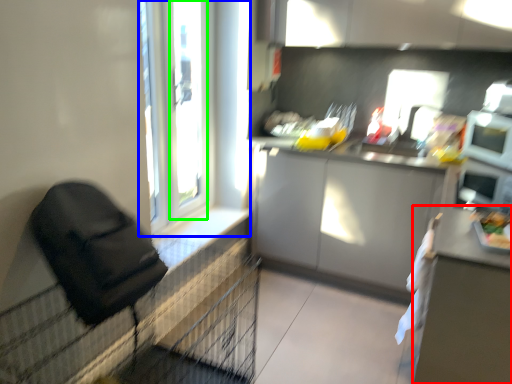
Question: Based on their relative distances, which object is nearer to table (highlighted by a red box)? Choose from window (highlighted by a blue box) and window frame (highlighted by a green box).

Choices:
 (A) window
 (B) window frame

Answer: (A)